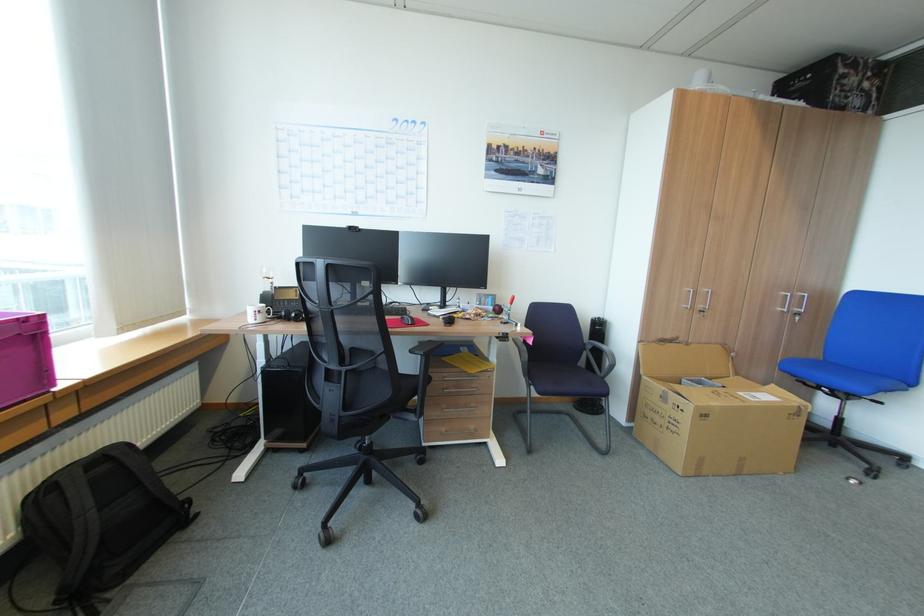
The location [496,309] corresponds to which object?

This point indicates the red apple.